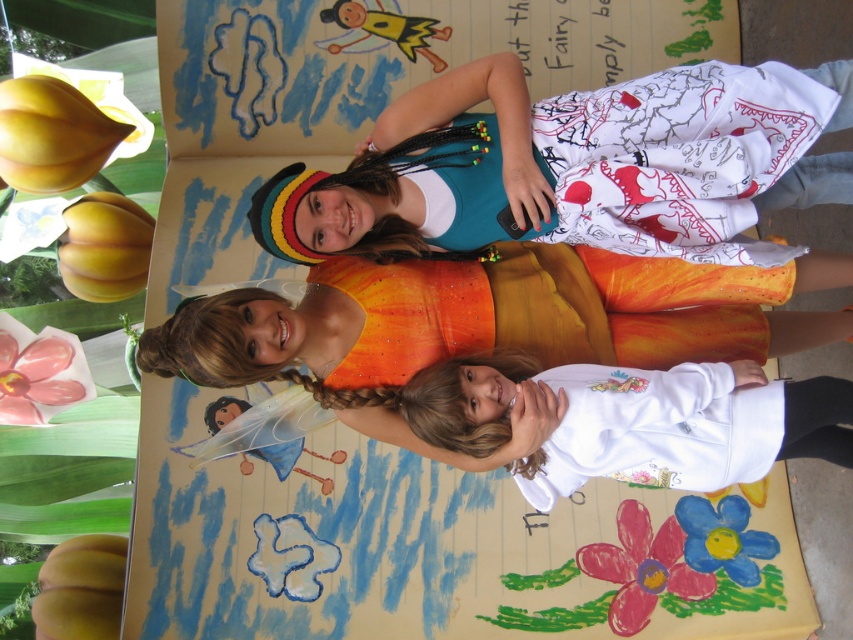
You are an artist trying to replicate the scene. You need to position the shiny orange fabric dress at center exactly where it was in the original image. What coordinates should you use?

The coordinates for the shiny orange fabric dress at center are point [550,308].

You are an artist looking to create a new design that incorporates both the shiny orange fabric dress at center and the blue painted flower at center. Which object should you focus on enlarging to maintain visual balance?

The shiny orange fabric dress at center is bigger than the blue painted flower at center. To maintain visual balance, you should focus on enlarging the blue painted flower at center to match the size of the dress.

You are an artist observing the scene. You notice the shiny orange fabric dress at center and the blue painted flower at center. Which object is positioned further to the left?

The shiny orange fabric dress at center is positioned further to the left than the blue painted flower at center.